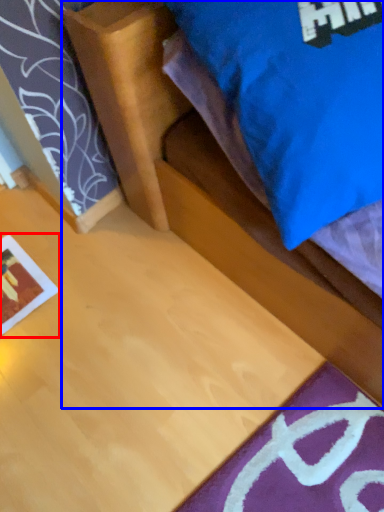
Question: Which object appears closest to the camera in this image, print (highlighted by a red box) or bed (highlighted by a blue box)?

Choices:
 (A) print
 (B) bed

Answer: (B)